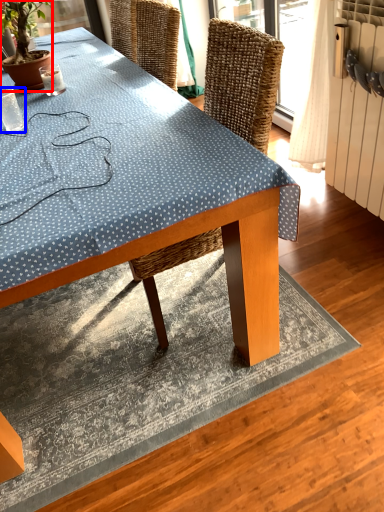
Question: Which object is further to the camera taking this photo, houseplant (highlighted by a red box) or coffee cup (highlighted by a blue box)?

Choices:
 (A) houseplant
 (B) coffee cup

Answer: (A)